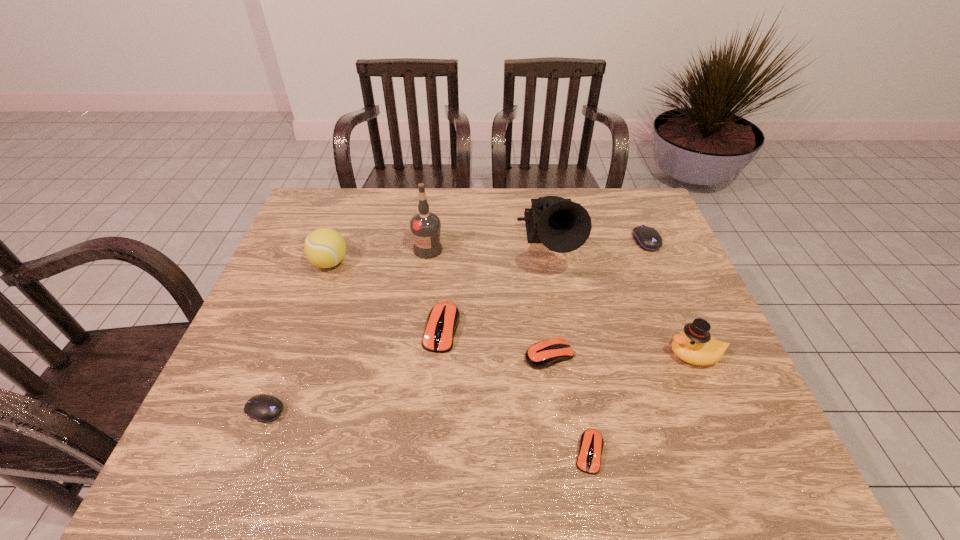
Locate an element on the screen. This screenshot has height=540, width=960. vacant space in between the leftmost orange computer mouse and the second smallest orange computer mouse is located at coordinates (495, 342).

At what (x,y) coordinates should I click in order to perform the action: click on vacant point located between the yellow tennis ball and the farthest computer mouse. Please return your answer as a coordinate pair (x, y). Image resolution: width=960 pixels, height=540 pixels. Looking at the image, I should click on (488, 252).

This screenshot has width=960, height=540. Find the location of `vacant space that is in between the second biggest orange computer mouse and the duck`. vacant space that is in between the second biggest orange computer mouse and the duck is located at coordinates click(622, 355).

Where is `vacant area between the leftmost orange computer mouse and the second smallest orange computer mouse`? The image size is (960, 540). vacant area between the leftmost orange computer mouse and the second smallest orange computer mouse is located at coordinates (495, 342).

At what (x,y) coordinates should I click in order to perform the action: click on object that stands as the seventh closest to the nearest computer mouse. Please return your answer as a coordinate pair (x, y). The width and height of the screenshot is (960, 540). Looking at the image, I should click on (425, 226).

Identify which object is the seventh nearest to the second smallest orange computer mouse. Please provide its 2D coordinates. Your answer should be formatted as a tuple, i.e. [(x, y)], where the tuple contains the x and y coordinates of a point satisfying the conditions above.

[(264, 408)]

Locate which computer mouse is the fourth closest to the nearest object. Please provide its 2D coordinates. Your answer should be formatted as a tuple, i.e. [(x, y)], where the tuple contains the x and y coordinates of a point satisfying the conditions above.

[(264, 408)]

Locate which computer mouse ranks third in proximity to the leftmost orange computer mouse. Please provide its 2D coordinates. Your answer should be formatted as a tuple, i.e. [(x, y)], where the tuple contains the x and y coordinates of a point satisfying the conditions above.

[(591, 442)]

Where is `orange computer mouse that stands as the third closest to the farther black computer mouse`? Image resolution: width=960 pixels, height=540 pixels. orange computer mouse that stands as the third closest to the farther black computer mouse is located at coordinates (591, 442).

What are the coordinates of `the second closest orange computer mouse to the second biggest orange computer mouse` in the screenshot? It's located at [x=443, y=319].